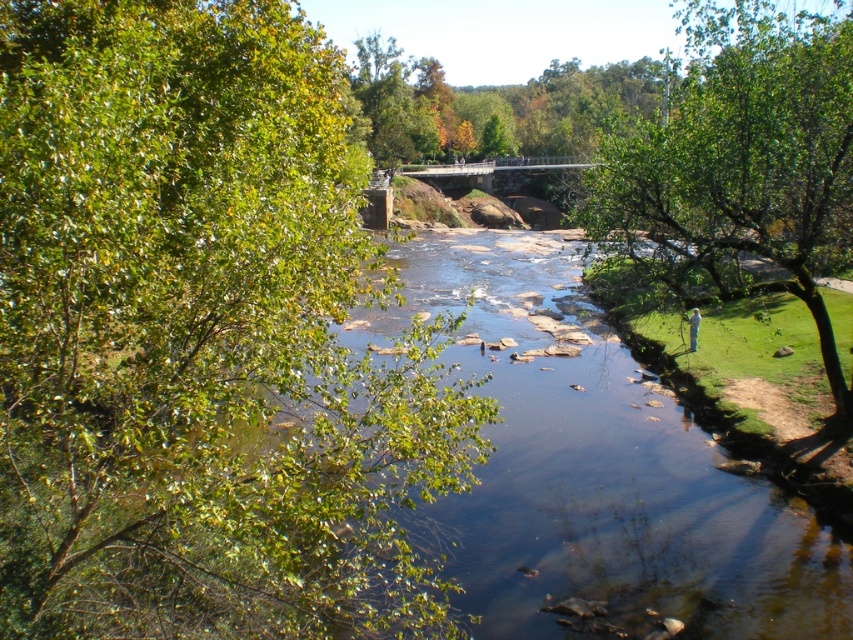
You are standing at the center of the river in the image. Which direction should you look to see the green leafy tree at left?

You should look to the left to see the green leafy tree at left, as it is located on the left side of the river.

You are standing at the point marked by the coordinates point (201,339) in the image. Looking around, you see a green leafy tree at left. Which direction should you face to see the green leafy tree at left?

You should face towards the left direction to see the green leafy tree at left, as the point (201,339) marks its location.